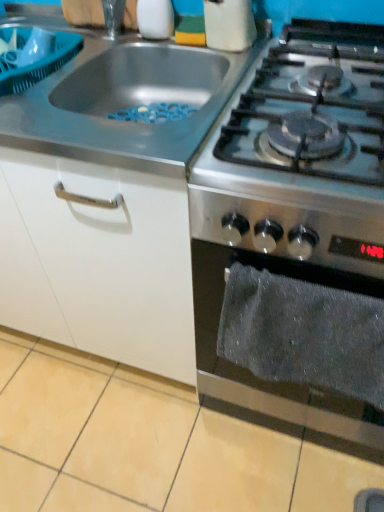
Question: From a real-world perspective, is white glossy salt shaker at upper center positioned under stainless steel gas stove at right, positioned as the first gas stove in right-to-left order, based on gravity?

Choices:
 (A) no
 (B) yes

Answer: (A)

Question: Is white glossy salt shaker at upper center wider than stainless steel gas stove at right, positioned as the first gas stove in right-to-left order?

Choices:
 (A) yes
 (B) no

Answer: (B)

Question: Is white glossy salt shaker at upper center surrounding stainless steel gas stove at right, which is counted as the second gas stove, starting from the left?

Choices:
 (A) yes
 (B) no

Answer: (B)

Question: From a real-world perspective, is white glossy salt shaker at upper center physically above stainless steel gas stove at right, which is counted as the second gas stove, starting from the left?

Choices:
 (A) no
 (B) yes

Answer: (B)

Question: Is white glossy salt shaker at upper center in contact with stainless steel gas stove at right, which is counted as the second gas stove, starting from the left?

Choices:
 (A) no
 (B) yes

Answer: (A)

Question: Is stainless steel gas stove at upper right, the 1th gas stove positioned from the left, in front of or behind gray fabric towel at lower right in the image?

Choices:
 (A) behind
 (B) front

Answer: (A)

Question: Looking at the image, does stainless steel gas stove at upper right, the 1th gas stove positioned from the left, seem bigger or smaller compared to gray fabric towel at lower right?

Choices:
 (A) big
 (B) small

Answer: (A)

Question: Looking at their shapes, would you say stainless steel gas stove at upper right, which appears as the 2th gas stove when viewed from the right, is wider or thinner than gray fabric towel at lower right?

Choices:
 (A) thin
 (B) wide

Answer: (B)

Question: Is point (188, 49) closer or farther from the camera than point (324, 420)?

Choices:
 (A) farther
 (B) closer

Answer: (A)

Question: Is stainless steel gas stove at right, which is counted as the second gas stove, starting from the left, wider or thinner than stainless steel gas stove at upper right, the 1th gas stove positioned from the left?

Choices:
 (A) wide
 (B) thin

Answer: (A)

Question: Considering their positions, is stainless steel gas stove at right, which is counted as the second gas stove, starting from the left, located in front of or behind stainless steel gas stove at upper right, the 1th gas stove positioned from the left?

Choices:
 (A) front
 (B) behind

Answer: (A)

Question: Is point coord(311,31) positioned closer to the camera than point coord(150,71)?

Choices:
 (A) closer
 (B) farther

Answer: (A)

Question: Do you think stainless steel gas stove at right, positioned as the first gas stove in right-to-left order, is within stainless steel gas stove at upper right, which appears as the 2th gas stove when viewed from the right, or outside of it?

Choices:
 (A) inside
 (B) outside

Answer: (B)

Question: Is point (162, 23) closer or farther from the camera than point (206, 96)?

Choices:
 (A) closer
 (B) farther

Answer: (B)

Question: Is white glossy salt shaker at upper center spatially inside stainless steel gas stove at upper right, which appears as the 2th gas stove when viewed from the right, or outside of it?

Choices:
 (A) outside
 (B) inside

Answer: (A)